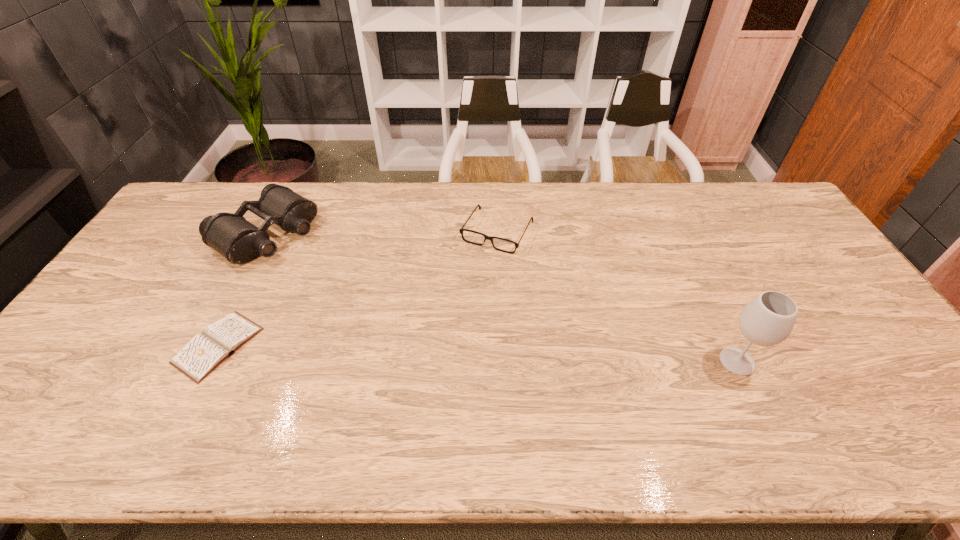
At what (x,y) coordinates should I click in order to perform the action: click on vacant spot on the desktop that is between the shortest object and the rightmost object and is positioned on the front-facing side of the spectacles. Please return your answer as a coordinate pair (x, y). Image resolution: width=960 pixels, height=540 pixels. Looking at the image, I should click on (430, 352).

Locate an element on the screen. The image size is (960, 540). free space on the desktop that is between the shortest object and the wineglass and is positioned through the eyepieces of the binoculars is located at coordinates (448, 353).